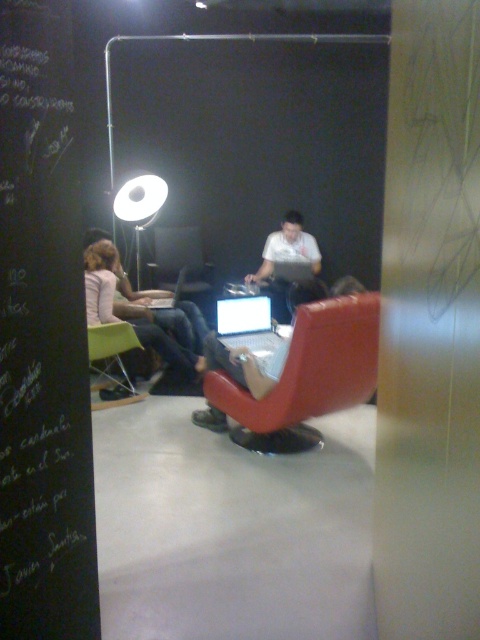
Question: Can you confirm if black chalkboard at left is positioned to the left of matte red swivel chair at center?

Choices:
 (A) yes
 (B) no

Answer: (A)

Question: Estimate the real-world distances between objects in this image. Which object is closer to the white matte shirt at center?

Choices:
 (A) white glossy floor lamp at upper left
 (B) matte red swivel chair at center

Answer: (A)

Question: Can you confirm if matte red swivel chair at center is wider than matte silver laptop at center?

Choices:
 (A) no
 (B) yes

Answer: (B)

Question: Which of the following is the closest to the observer?

Choices:
 (A) matte black chair at center
 (B) white glossy floor lamp at upper left
 (C) matte white laptop at left
 (D) matte red swivel chair at center

Answer: (D)

Question: Which point is closer to the camera?

Choices:
 (A) (191, 240)
 (B) (317, 259)
 (C) (140, 284)

Answer: (B)

Question: Can you confirm if matte silver laptop at center is positioned to the right of silver metallic laptop at center?

Choices:
 (A) yes
 (B) no

Answer: (A)